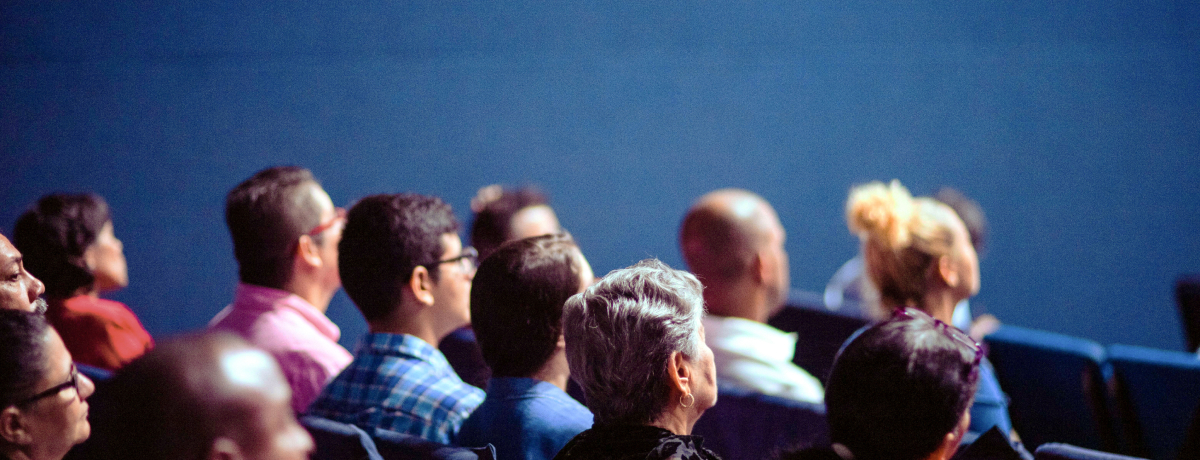
Where is `chairs`? chairs is located at coordinates (1146, 372), (1048, 357), (829, 324), (1060, 449), (800, 419), (714, 424), (319, 431), (434, 454), (94, 376).